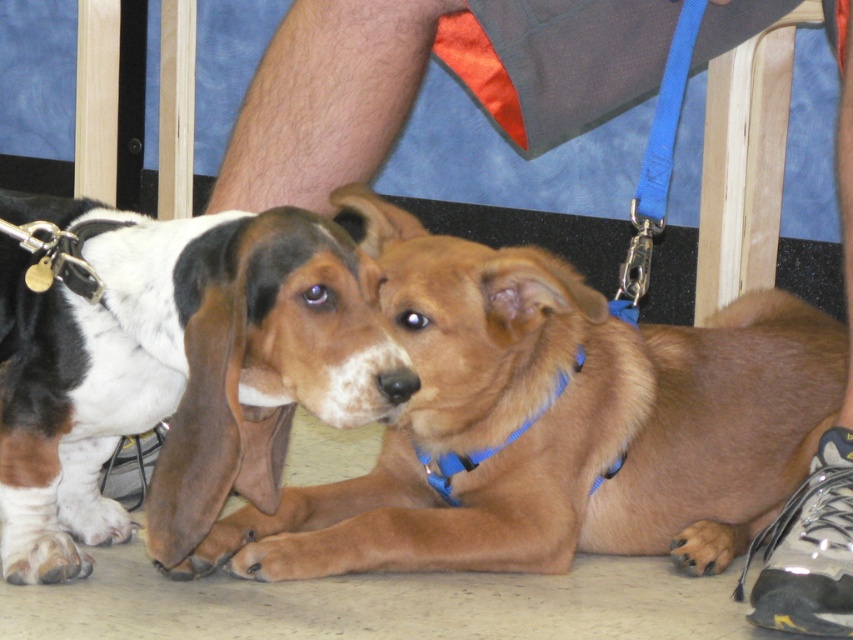
Question: Is brown furry dog at center behind brown fur dog at center?

Choices:
 (A) no
 (B) yes

Answer: (B)

Question: Which object is farther from the camera taking this photo?

Choices:
 (A) brown furry dog at center
 (B) blue fabric neckband at center
 (C) brown fur dog at center

Answer: (B)

Question: Which of the following is the closest to the observer?

Choices:
 (A) brown furry dog at center
 (B) blue fabric neckband at center

Answer: (A)

Question: Is brown furry dog at center smaller than blue fabric neckband at center?

Choices:
 (A) yes
 (B) no

Answer: (B)

Question: Is brown furry dog at center positioned behind brown fur dog at center?

Choices:
 (A) no
 (B) yes

Answer: (B)

Question: Considering the real-world distances, which object is closest to the brown furry dog at center?

Choices:
 (A) blue fabric neckband at center
 (B) brown fur dog at center

Answer: (A)